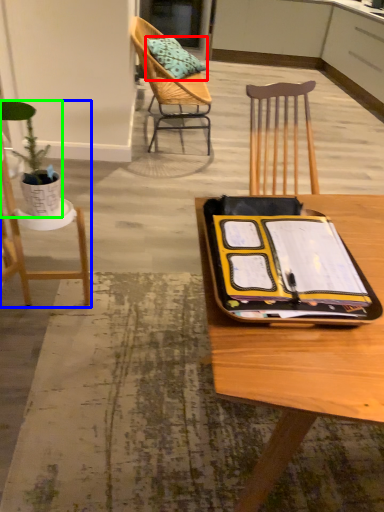
Question: Which object is positioned closest to pillow (highlighted by a red box)? Select from chair (highlighted by a blue box) and houseplant (highlighted by a green box).

Choices:
 (A) chair
 (B) houseplant

Answer: (A)